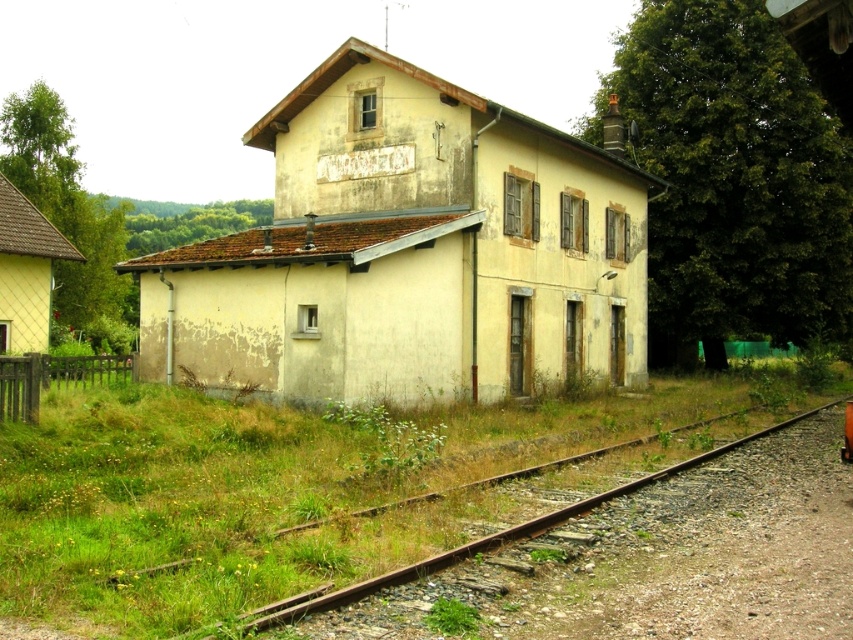
Question: From the image, what is the correct spatial relationship of rusty metal train track at lower right in relation to orange matte train at lower right?

Choices:
 (A) left
 (B) right

Answer: (A)

Question: Among these points, which one is nearest to the camera?

Choices:
 (A) (509, 536)
 (B) (848, 440)

Answer: (A)

Question: Among these objects, which one is nearest to the camera?

Choices:
 (A) orange matte train at lower right
 (B) rusty metal train track at lower right

Answer: (B)

Question: Which point appears farthest from the camera in this image?

Choices:
 (A) (843, 429)
 (B) (572, 595)

Answer: (A)

Question: Does rusty metal train track at lower right appear over orange matte train at lower right?

Choices:
 (A) yes
 (B) no

Answer: (B)

Question: In this image, where is rusty metal train track at lower right located relative to orange matte train at lower right?

Choices:
 (A) right
 (B) left

Answer: (B)